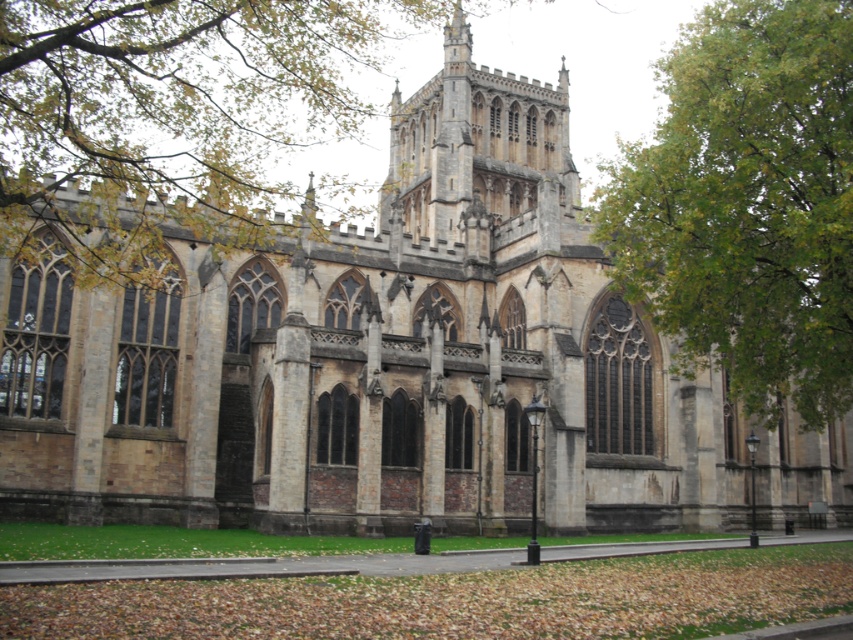
Question: Is green leafy tree at upper center closer to camera compared to green leafy tree at upper right?

Choices:
 (A) yes
 (B) no

Answer: (A)

Question: Which point is closer to the camera taking this photo?

Choices:
 (A) (126, 278)
 (B) (676, 292)

Answer: (A)

Question: Which of the following is the closest to the observer?

Choices:
 (A) (62, 234)
 (B) (675, 234)

Answer: (B)

Question: Which of the following is the closest to the observer?

Choices:
 (A) (142, 225)
 (B) (775, 310)

Answer: (B)

Question: In this image, where is green leafy tree at upper center located relative to green leafy tree at upper right?

Choices:
 (A) right
 (B) left

Answer: (B)

Question: Does green leafy tree at upper center have a smaller size compared to green leafy tree at upper right?

Choices:
 (A) no
 (B) yes

Answer: (A)